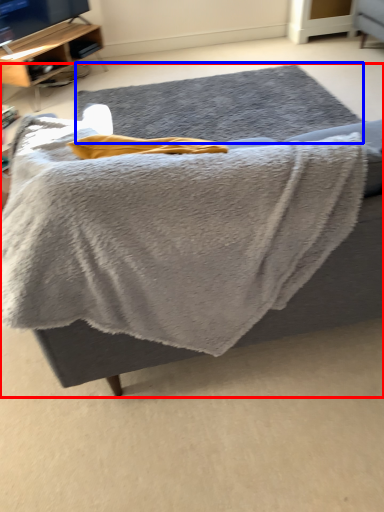
Question: Among these objects, which one is farthest to the camera, furniture (highlighted by a red box) or mat (highlighted by a blue box)?

Choices:
 (A) furniture
 (B) mat

Answer: (B)